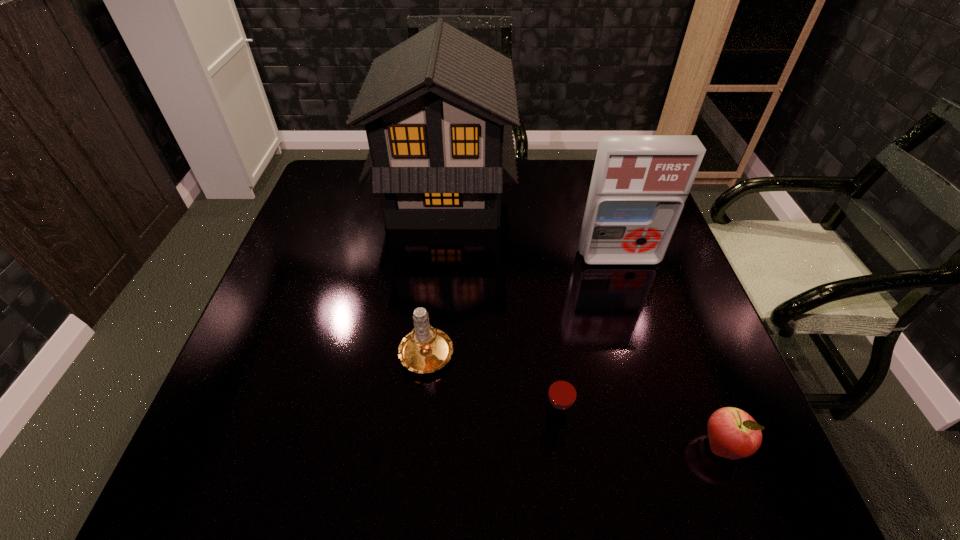
At what (x,y) coordinates should I click in order to perform the action: click on dollhouse. Please return your answer as a coordinate pair (x, y). Looking at the image, I should click on (438, 109).

Identify the location of the tallest object. The width and height of the screenshot is (960, 540). (438, 109).

You are a GUI agent. You are given a task and a screenshot of the screen. Output one action in this format:
    pyautogui.click(x=<x>, y=<y>)
    Task: Click on the second farthest object
    
    Given the screenshot: What is the action you would take?
    pyautogui.click(x=639, y=185)

This screenshot has width=960, height=540. What are the coordinates of `the first-aid kit` in the screenshot? It's located at (639, 185).

Find the location of a particular element. The image size is (960, 540). candle is located at coordinates (426, 349).

This screenshot has height=540, width=960. In order to click on the third tallest object in this screenshot , I will do `click(426, 349)`.

Identify the location of glass. (562, 393).

Where is `apple`? This screenshot has height=540, width=960. apple is located at coordinates (733, 434).

Find the location of `vacant area located on the front-facing side of the tallest object`. vacant area located on the front-facing side of the tallest object is located at coordinates (557, 195).

You are a GUI agent. You are given a task and a screenshot of the screen. Output one action in this format:
    pyautogui.click(x=<x>, y=<y>)
    Task: Click on the vacant area situated 0.170m on the front-facing side of the fourth nearest object
    
    Given the screenshot: What is the action you would take?
    pyautogui.click(x=639, y=322)